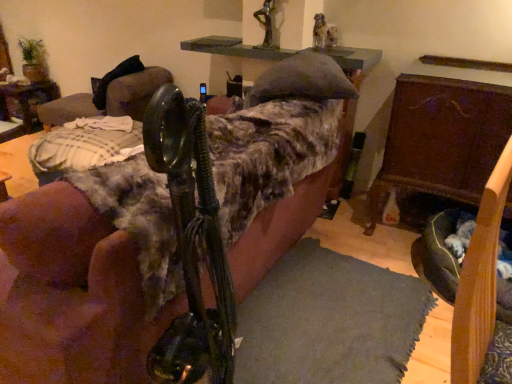
Question: From the image's perspective, is wooden chest at right, which is the second furniture in left-to-right order, positioned above or below dark gray fabric dog bed at lower right?

Choices:
 (A) above
 (B) below

Answer: (A)

Question: Does point (488, 115) appear closer or farther from the camera than point (456, 271)?

Choices:
 (A) farther
 (B) closer

Answer: (A)

Question: Considering the real-world distances, which object is farthest from the velvet couch at center, placed as the second furniture when sorted from right to left?

Choices:
 (A) black leather swivel chair at upper left
 (B) metallic statue at upper center
 (C) dark gray fabric dog bed at lower right
 (D) wooden table at left
 (E) wooden chest at right, which is the second furniture in left-to-right order

Answer: (D)

Question: Estimate the real-world distances between objects in this image. Which object is farther from the dark gray fabric dog bed at lower right?

Choices:
 (A) wooden chest at right, placed as the first furniture when sorted from right to left
 (B) black leather swivel chair at upper left
 (C) wooden table at left
 (D) metallic statue at upper center
 (E) velvet couch at center, placed as the second furniture when sorted from right to left

Answer: (C)